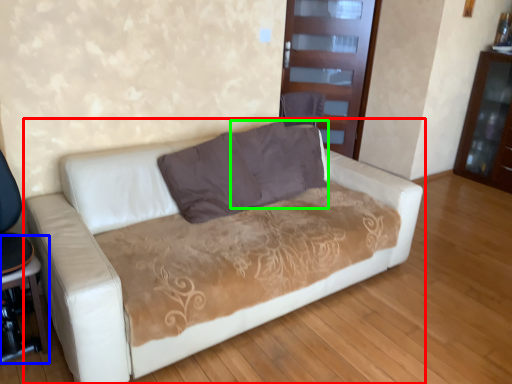
Question: Considering the real-world distances, which object is closest to studio couch (highlighted by a red box)? table (highlighted by a blue box) or pillow (highlighted by a green box).

Choices:
 (A) table
 (B) pillow

Answer: (B)